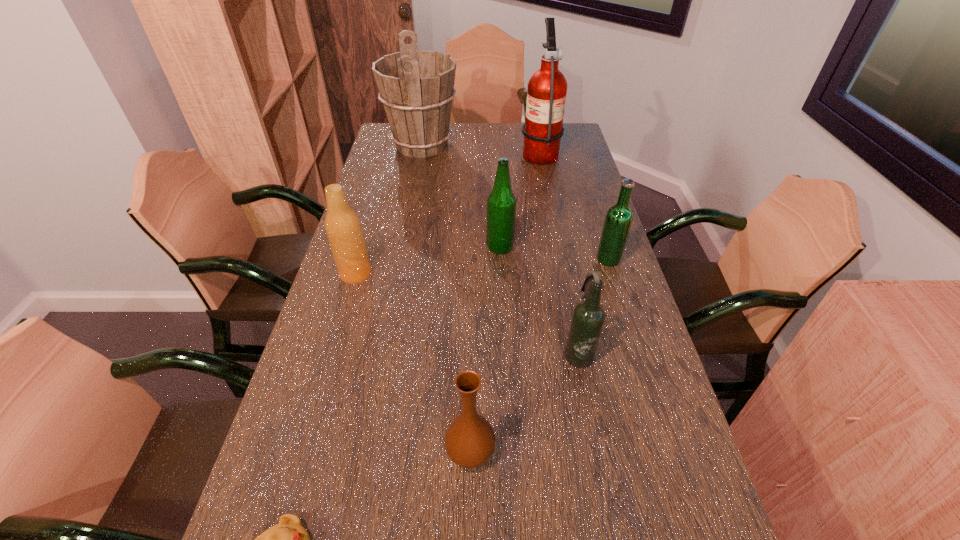
At what (x,y) coordinates should I click in order to perform the action: click on free space located 0.180m on the nozzle and handle of the tallest object. Please return your answer as a coordinate pair (x, y). This screenshot has width=960, height=540. Looking at the image, I should click on (475, 152).

I want to click on free spot located on the right of the second tallest object, so click(x=523, y=145).

Identify the location of vacant area situated 0.170m on the label of the third beer bottle from right to left. (430, 247).

Where is `vacant area located 0.370m on the label of the third beer bottle from right to left`? vacant area located 0.370m on the label of the third beer bottle from right to left is located at coordinates (365, 247).

Identify the location of vacant space located 0.280m on the label of the third beer bottle from right to left. (395, 247).

The width and height of the screenshot is (960, 540). Identify the location of vacant area situated on the back of the leftmost beer bottle. point(370,226).

You are a GUI agent. You are given a task and a screenshot of the screen. Output one action in this format:
    pyautogui.click(x=<x>, y=<y>)
    Task: Click on the free space located on the back of the rightmost object
    
    Given the screenshot: What is the action you would take?
    pyautogui.click(x=590, y=202)

This screenshot has height=540, width=960. In order to click on blank space located 0.060m on the back of the third nearest object in this screenshot , I will do `click(571, 319)`.

I want to click on vacant region located on the left of the seventh farthest object, so click(x=406, y=451).

The image size is (960, 540). I want to click on fire extinguisher present at the far edge, so click(546, 95).